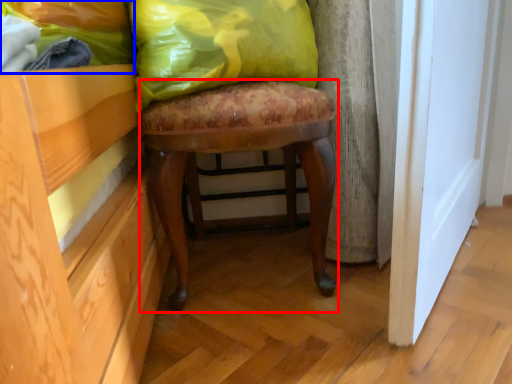
Question: Which point is further to the camera, stool (highlighted by a red box) or fabric (highlighted by a blue box)?

Choices:
 (A) stool
 (B) fabric

Answer: (A)